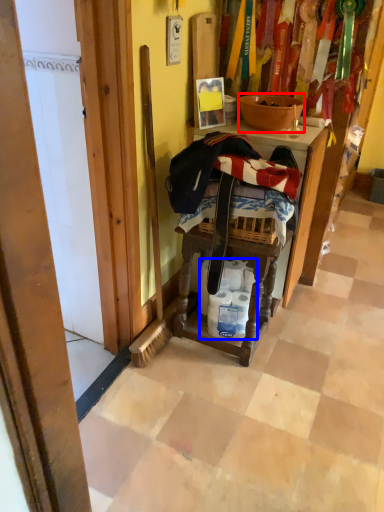
Question: Which point is further to the camera, bowl (highlighted by a red box) or toilet paper (highlighted by a blue box)?

Choices:
 (A) bowl
 (B) toilet paper

Answer: (B)